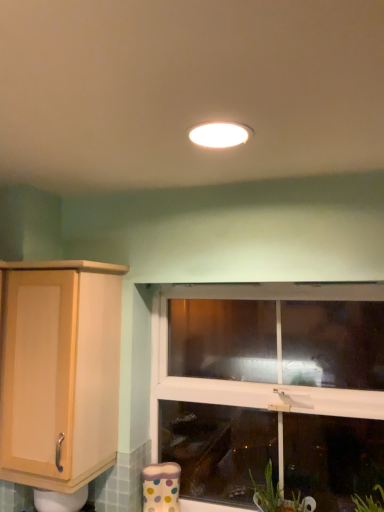
What do you see at coordinates (59, 372) in the screenshot?
I see `light wood cabinet at left` at bounding box center [59, 372].

What is the approximate width of light wood cabinet at left?

The width of light wood cabinet at left is 13.56 inches.

At what (x,y) coordinates should I click in order to perform the action: click on white glossy light fixture at center. Please return your answer as a coordinate pair (x, y). Image resolution: width=384 pixels, height=512 pixels. Looking at the image, I should click on (220, 134).

From the picture: Is light wood cabinet at left a part of white glossy light fixture at center?

No, light wood cabinet at left is not inside white glossy light fixture at center.

Which of these two, white glossy light fixture at center or light wood cabinet at left, is wider?

With larger width is light wood cabinet at left.

Which is in front, white glossy light fixture at center or light wood cabinet at left?

white glossy light fixture at center is closer to the camera.

Which object is closer to the camera, clear glass window at center or light wood cabinet at left?

light wood cabinet at left is more forward.

From the image's perspective, between clear glass window at center and light wood cabinet at left, which one is located above?

light wood cabinet at left appears higher in the image.

Find the location of a particular element. cabinetry on the left of clear glass window at center is located at coordinates (59, 372).

Is clear glass window at center positioned with its back to light wood cabinet at left?

clear glass window at center does not have its back to light wood cabinet at left.

Is point (76, 365) positioned behind point (244, 129)?

That is True.

Is light wood cabinet at left positioned with its back to white glossy light fixture at center?

No, light wood cabinet at left is not facing the opposite direction of white glossy light fixture at center.

Locate an element on the screen. Image resolution: width=384 pixels, height=512 pixels. cabinetry located behind the white glossy light fixture at center is located at coordinates (59, 372).

From the image's perspective, does clear glass window at center appear lower than white glossy light fixture at center?

Yes, from the image's perspective, clear glass window at center is below white glossy light fixture at center.

Is the surface of clear glass window at center in direct contact with white glossy light fixture at center?

clear glass window at center and white glossy light fixture at center are not in contact.

Which object is closer to the camera, clear glass window at center or white glossy light fixture at center?

white glossy light fixture at center is closer to the camera.

Is clear glass window at center inside or outside of white glossy light fixture at center?

clear glass window at center cannot be found inside white glossy light fixture at center.

Is clear glass window at center located within white glossy light fixture at center?

Actually, clear glass window at center is outside white glossy light fixture at center.

From the image's perspective, is white glossy light fixture at center above clear glass window at center?

Correct, white glossy light fixture at center appears higher than clear glass window at center in the image.

In terms of height, does white glossy light fixture at center look taller or shorter compared to clear glass window at center?

Clearly, white glossy light fixture at center is shorter compared to clear glass window at center.

Is white glossy light fixture at center facing away from clear glass window at center?

No, white glossy light fixture at center's orientation is not away from clear glass window at center.

Is light wood cabinet at left positioned far away from clear glass window at center?

No.

From the picture: From a real-world perspective, is light wood cabinet at left located beneath clear glass window at center?

No, from a real-world perspective, light wood cabinet at left is not under clear glass window at center.

From the image's perspective, between light wood cabinet at left and clear glass window at center, who is located below?

clear glass window at center is shown below in the image.

This screenshot has height=512, width=384. In order to click on light fixture that is above the light wood cabinet at left (from a real-world perspective) in this screenshot , I will do `click(220, 134)`.

Image resolution: width=384 pixels, height=512 pixels. What are the coordinates of `cabinetry above the clear glass window at center (from the image's perspective)` in the screenshot? It's located at (59, 372).

From the image, which object appears to be farther from light wood cabinet at left, clear glass window at center or white glossy light fixture at center?

white glossy light fixture at center is further to light wood cabinet at left.

Considering their positions, is light wood cabinet at left positioned further to white glossy light fixture at center than clear glass window at center?

clear glass window at center is positioned further to the anchor white glossy light fixture at center.

Estimate the real-world distances between objects in this image. Which object is further from clear glass window at center, white glossy light fixture at center or light wood cabinet at left?

white glossy light fixture at center.

Considering their positions, is clear glass window at center positioned closer to white glossy light fixture at center than light wood cabinet at left?

light wood cabinet at left lies closer to white glossy light fixture at center than the other object.

Considering their positions, is light wood cabinet at left positioned further to clear glass window at center than white glossy light fixture at center?

white glossy light fixture at center is positioned further to the anchor clear glass window at center.

Looking at the image, which one is located closer to light wood cabinet at left, white glossy light fixture at center or clear glass window at center?

clear glass window at center is closer to light wood cabinet at left.

Locate an element on the screen. This screenshot has height=512, width=384. cabinetry between white glossy light fixture at center and clear glass window at center from top to bottom is located at coordinates (59, 372).